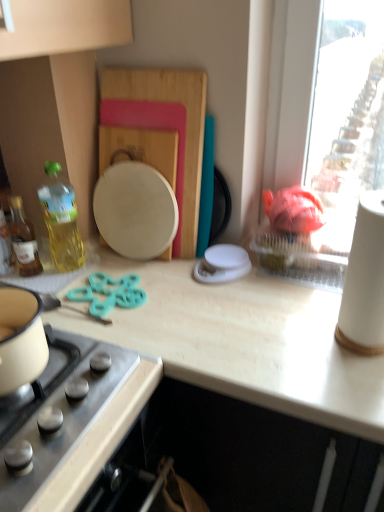
At what (x,y) coordinates should I click in order to perform the action: click on free space to the right of teal plastic scissors at center. Please return your answer as a coordinate pair (x, y). The image size is (384, 512). Looking at the image, I should click on [x=183, y=302].